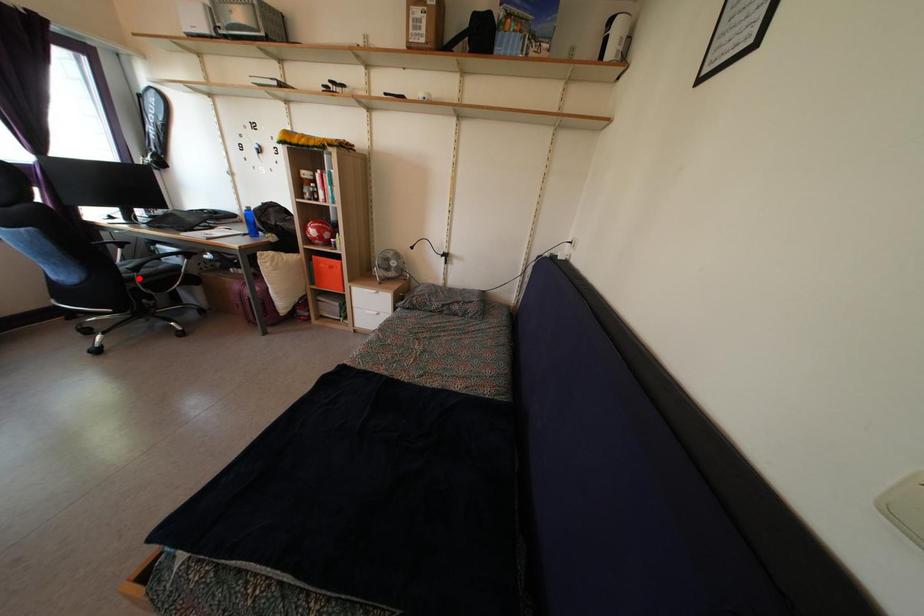
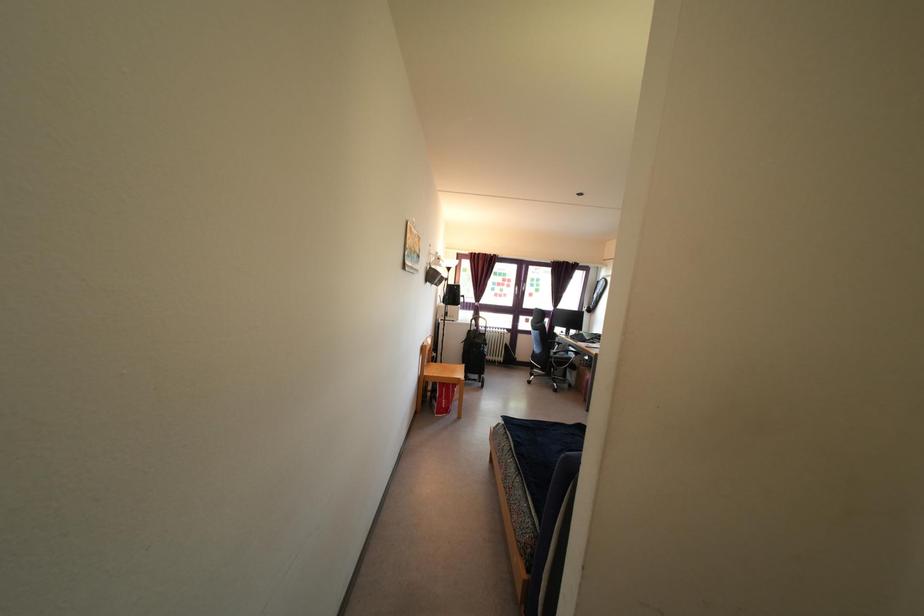
Locate, in the second image, the point that corresponds to the highlighted location in the first image.

(557, 362)